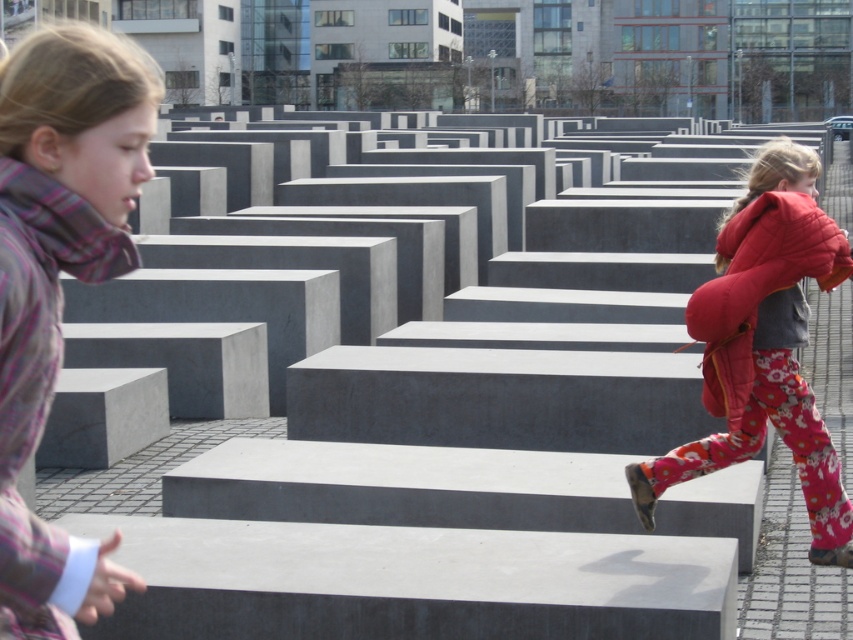
Does floral pants at right appear over matte red jacket at right?

No.

Is floral pants at right thinner than matte red jacket at right?

Incorrect, floral pants at right's width is not less than matte red jacket at right's.

Describe the element at coordinates (764, 346) in the screenshot. I see `floral pants at right` at that location.

I want to click on floral pants at right, so click(764, 346).

Who is taller, plaid wool scarf at left or matte red jacket at right?

With more height is plaid wool scarf at left.

Identify the location of plaid wool scarf at left. (57, 272).

Does plaid wool scarf at left have a larger size compared to floral pants at right?

No.

Describe the element at coordinates (57, 272) in the screenshot. The width and height of the screenshot is (853, 640). I see `plaid wool scarf at left` at that location.

Is point (70, 240) farther from camera compared to point (734, 340)?

No, (70, 240) is in front of (734, 340).

You are a GUI agent. You are given a task and a screenshot of the screen. Output one action in this format:
    pyautogui.click(x=<x>, y=<y>)
    Task: Click on the plaid wool scarf at left
    
    Given the screenshot: What is the action you would take?
    pos(57,272)